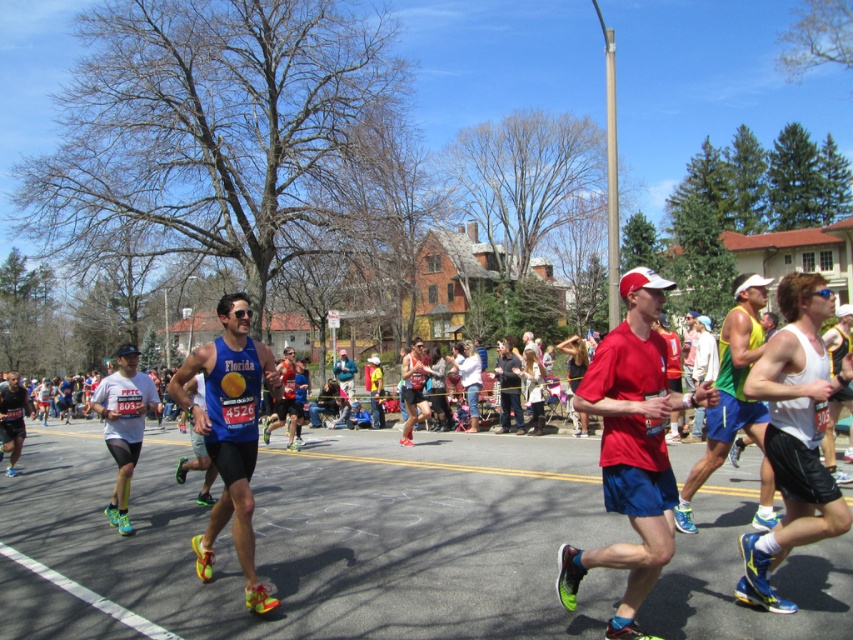
Question: Is blue fabric tank top at center wider than white matte cap at upper center?

Choices:
 (A) no
 (B) yes

Answer: (B)

Question: Which object appears farthest from the camera in this image?

Choices:
 (A) white matte running shorts at center
 (B) white matte tank top at center
 (C) blue athletic shorts at center

Answer: (A)

Question: Can you confirm if green fabric tank top at center is positioned below blue athletic shorts at center?

Choices:
 (A) no
 (B) yes

Answer: (A)

Question: Can you confirm if white matte running shorts at center is positioned to the right of white matte cap at upper center?

Choices:
 (A) no
 (B) yes

Answer: (A)

Question: Which point is farther from the camera taking this photo?

Choices:
 (A) (711, 355)
 (B) (9, 476)

Answer: (B)

Question: Estimate the real-world distances between objects in this image. Which object is closer to the white matte tank top at center?

Choices:
 (A) white matte running shorts at center
 (B) matte black tank top at center
 (C) blue fabric tank top at center

Answer: (C)